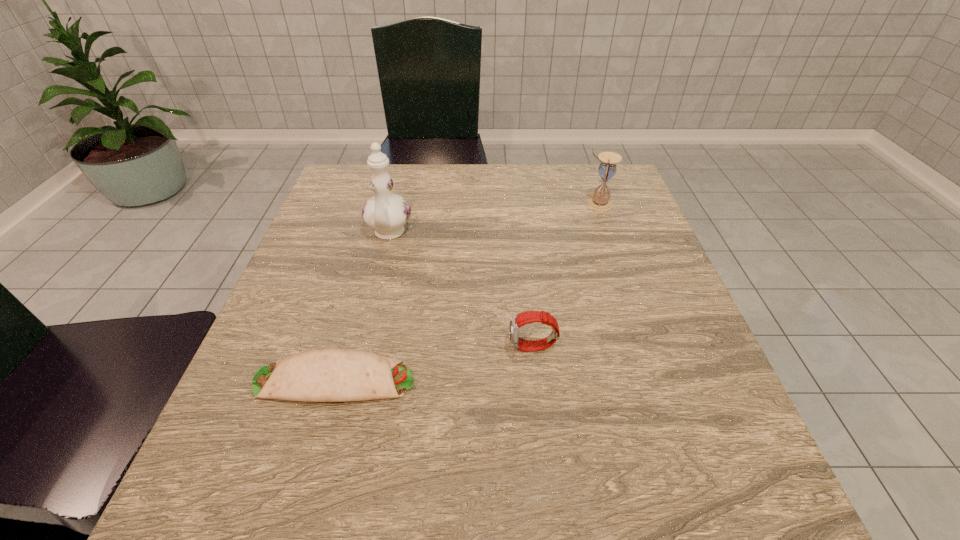
Locate an element on the screen. This screenshot has width=960, height=540. vacant space at the left edge of the desktop is located at coordinates (290, 316).

Image resolution: width=960 pixels, height=540 pixels. In order to click on vacant space at the right edge of the desktop in this screenshot , I will do `click(658, 374)`.

The width and height of the screenshot is (960, 540). I want to click on vacant area at the near left corner of the desktop, so click(x=249, y=501).

The width and height of the screenshot is (960, 540). What are the coordinates of `free spot at the far right corner of the desktop` in the screenshot? It's located at (570, 170).

Identify the location of vacant space at the near right corner. (781, 522).

Where is `vacant space that's between the shortest object and the farthest object`? This screenshot has height=540, width=960. vacant space that's between the shortest object and the farthest object is located at coordinates (467, 292).

Image resolution: width=960 pixels, height=540 pixels. In order to click on vacant area that lies between the rightmost object and the tallest object in this screenshot , I will do `click(493, 219)`.

Where is `free spot between the chinaware and the burrito`? free spot between the chinaware and the burrito is located at coordinates (362, 307).

In order to click on free spot between the third nearest object and the shortest object in this screenshot , I will do 362,307.

The image size is (960, 540). Identify the location of unoccupied position between the burrito and the rightmost object. (467, 292).